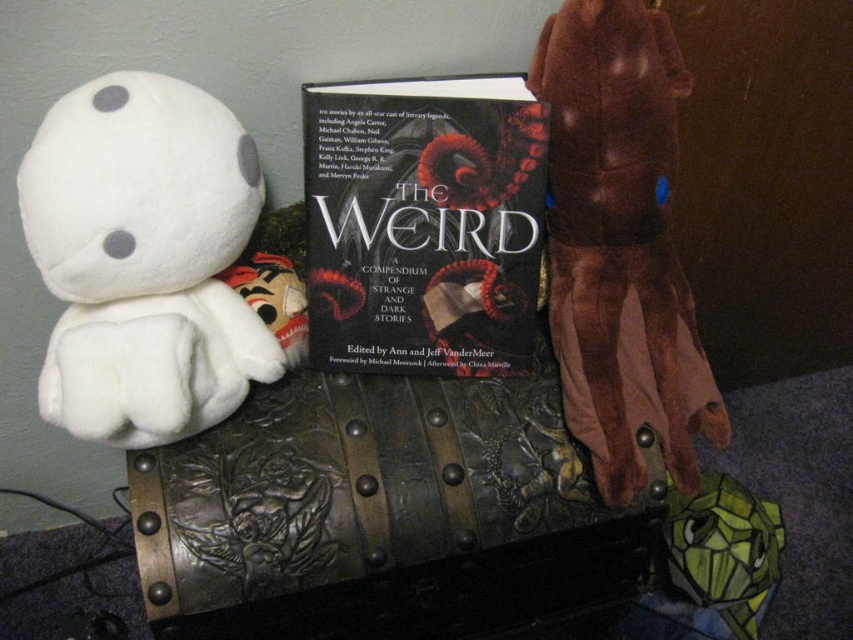
Question: Which point is closer to the camera?

Choices:
 (A) white plush toy at left
 (B) dark matte book at center
 (C) brown plush toy at right

Answer: (A)

Question: Which point is closer to the camera?

Choices:
 (A) [128, 285]
 (B) [509, 157]

Answer: (A)

Question: Which object is positioned closest to the dark matte book at center?

Choices:
 (A) white plush toy at left
 (B) brown plush toy at right

Answer: (B)

Question: Does dark matte book at center appear over brown plush toy at right?

Choices:
 (A) yes
 (B) no

Answer: (A)

Question: Can you confirm if dark matte book at center is smaller than brown plush toy at right?

Choices:
 (A) no
 (B) yes

Answer: (B)

Question: Is white plush toy at left positioned before brown plush toy at right?

Choices:
 (A) yes
 (B) no

Answer: (A)